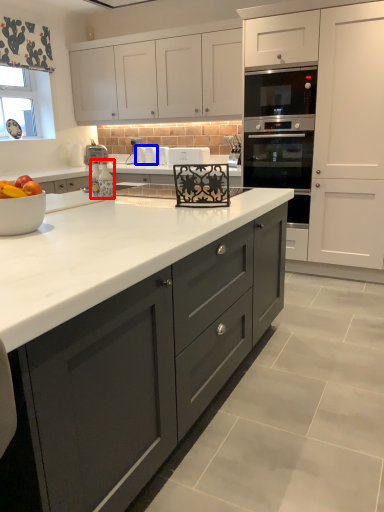
Question: Among these objects, which one is nearest to the camera, appliance (highlighted by a red box) or appliance (highlighted by a blue box)?

Choices:
 (A) appliance
 (B) appliance

Answer: (A)